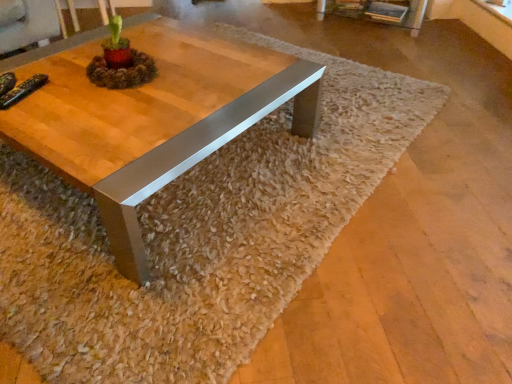
The width and height of the screenshot is (512, 384). What do you see at coordinates (151, 116) in the screenshot?
I see `satin silver coffee table at center` at bounding box center [151, 116].

Find the location of `satin silver coffee table at center`. satin silver coffee table at center is located at coordinates (151, 116).

At what (x,y) coordinates should I click in order to perform the action: click on satin silver coffee table at center. Please return your answer as a coordinate pair (x, y). Looking at the image, I should click on (151, 116).